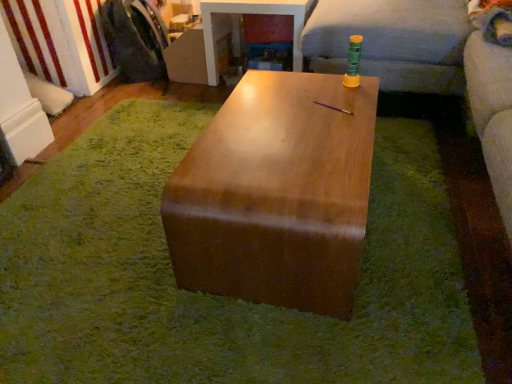
Where is `free space on the front side of glossy wood table at center, the 2th table when ordered from top to bottom`? The height and width of the screenshot is (384, 512). free space on the front side of glossy wood table at center, the 2th table when ordered from top to bottom is located at coordinates (309, 326).